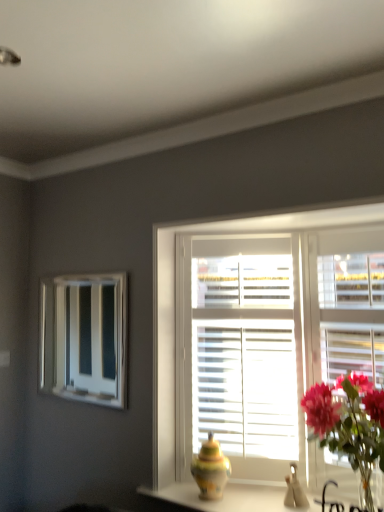
This screenshot has height=512, width=384. Describe the element at coordinates (224, 497) in the screenshot. I see `matte ceramic vase at center` at that location.

Find the location of a particular element. multicolored ceramic vase at center is located at coordinates (211, 469).

At what (x,y) coordinates should I click in order to perform the action: click on white wooden window at center. Please return your answer as a coordinate pair (x, y). Looking at the image, I should click on (264, 334).

The width and height of the screenshot is (384, 512). I want to click on matte ceramic vase at center, so click(x=224, y=497).

Is white wooden window at center to the left or to the right of multicolored ceramic vase at center in the image?

Based on their positions, white wooden window at center is located to the right of multicolored ceramic vase at center.

Is white wooden window at center in front of multicolored ceramic vase at center?

Yes, white wooden window at center is closer to the camera.

Considering the points (251, 222) and (216, 461), which point is behind, point (251, 222) or point (216, 461)?

The point (251, 222) is farther.

Is white wooden window at center inside the boundaries of multicolored ceramic vase at center, or outside?

The correct answer is: outside.

Are white glossy mirror at upper left and matte ceramic vase at center making contact?

No, white glossy mirror at upper left is not touching matte ceramic vase at center.

Which object is further away from the camera taking this photo, white glossy mirror at upper left or matte ceramic vase at center?

white glossy mirror at upper left is behind.

Is point (76, 287) closer to camera compared to point (219, 508)?

No, (76, 287) is further to viewer.

From a real-world perspective, is matte ceramic vase at center positioned under white glossy mirror at upper left based on gravity?

Yes, from a real-world perspective, matte ceramic vase at center is beneath white glossy mirror at upper left.

In the scene shown: Considering the sizes of objects matte ceramic vase at center and white glossy mirror at upper left in the image provided, who is taller, matte ceramic vase at center or white glossy mirror at upper left?

white glossy mirror at upper left.

Is matte ceramic vase at center completely or partially outside of white glossy mirror at upper left?

Yes, matte ceramic vase at center is located beyond the bounds of white glossy mirror at upper left.

Considering the relative sizes of matte ceramic vase at center and white glossy mirror at upper left in the image provided, is matte ceramic vase at center wider than white glossy mirror at upper left?

Yes.

How different are the orientations of white wooden window at center and matte ceramic vase at center in degrees?

The angle between the facing direction of white wooden window at center and the facing direction of matte ceramic vase at center is 0.866 degrees.

Is white wooden window at center aimed at matte ceramic vase at center?

No, white wooden window at center is not oriented towards matte ceramic vase at center.

Who is smaller, white wooden window at center or matte ceramic vase at center?

matte ceramic vase at center.

Is matte ceramic vase at center completely or partially inside white wooden window at center?

Yes, matte ceramic vase at center can be found within white wooden window at center.

From the image's perspective, which object appears higher, white wooden window at center or white glossy mirror at upper left?

white glossy mirror at upper left, from the image's perspective.

Does white wooden window at center have a smaller size compared to white glossy mirror at upper left?

No.

Is white wooden window at center shorter than white glossy mirror at upper left?

No, white wooden window at center is not shorter than white glossy mirror at upper left.

Is there a large distance between white wooden window at center and white glossy mirror at upper left?

Yes, white wooden window at center and white glossy mirror at upper left are quite far apart.

Is matte ceramic vase at center placed right next to multicolored ceramic vase at center?

No.

Does point (143, 493) come in front of point (208, 433)?

Yes, point (143, 493) is closer to viewer.

Is matte ceramic vase at center inside or outside of multicolored ceramic vase at center?

matte ceramic vase at center is spatially situated outside multicolored ceramic vase at center.

Is matte ceramic vase at center in front of or behind multicolored ceramic vase at center in the image?

matte ceramic vase at center is positioned closer to the viewer than multicolored ceramic vase at center.

Which of these two, multicolored ceramic vase at center or white glossy mirror at upper left, is bigger?

With larger size is white glossy mirror at upper left.

From the picture: Does multicolored ceramic vase at center have a greater width compared to white glossy mirror at upper left?

Yes.

Which of these two, multicolored ceramic vase at center or white glossy mirror at upper left, stands taller?

With more height is white glossy mirror at upper left.

From a real-world perspective, is multicolored ceramic vase at center positioned above or below white glossy mirror at upper left?

multicolored ceramic vase at center is situated lower than white glossy mirror at upper left in the real world.

Identify the location of window that appears in front of the multicolored ceramic vase at center. (264, 334).

Locate an element on the screen. counter top below the white glossy mirror at upper left (from the image's perspective) is located at coordinates (224, 497).

Considering their positions, is white glossy mirror at upper left positioned closer to matte ceramic vase at center than white wooden window at center?

white wooden window at center is closer to matte ceramic vase at center.

Considering their positions, is matte ceramic vase at center positioned further to white glossy mirror at upper left than white wooden window at center?

matte ceramic vase at center lies further to white glossy mirror at upper left than the other object.

In the scene shown: Estimate the real-world distances between objects in this image. Which object is further from matte ceramic vase at center, white glossy mirror at upper left or multicolored ceramic vase at center?

white glossy mirror at upper left is positioned further to the anchor matte ceramic vase at center.

Based on their spatial positions, is white glossy mirror at upper left or matte ceramic vase at center further from multicolored ceramic vase at center?

white glossy mirror at upper left.

From the image, which object appears to be nearer to white wooden window at center, matte ceramic vase at center or white glossy mirror at upper left?

matte ceramic vase at center is positioned closer to the anchor white wooden window at center.

From the image, which object appears to be farther from multicolored ceramic vase at center, white glossy mirror at upper left or white wooden window at center?

Among the two, white glossy mirror at upper left is located further to multicolored ceramic vase at center.

From the image, which object appears to be nearer to matte ceramic vase at center, white wooden window at center or white glossy mirror at upper left?

white wooden window at center is positioned closer to the anchor matte ceramic vase at center.

Estimate the real-world distances between objects in this image. Which object is closer to matte ceramic vase at center, multicolored ceramic vase at center or white wooden window at center?

Based on the image, multicolored ceramic vase at center appears to be nearer to matte ceramic vase at center.

Locate an element on the screen. The width and height of the screenshot is (384, 512). vase between white wooden window at center and matte ceramic vase at center in the vertical direction is located at coordinates (211, 469).

The width and height of the screenshot is (384, 512). I want to click on vase located between white glossy mirror at upper left and white wooden window at center in the left-right direction, so click(211, 469).

Where is `counter top between white glossy mirror at upper left and white wooden window at center`? counter top between white glossy mirror at upper left and white wooden window at center is located at coordinates (224, 497).

At what (x,y) coordinates should I click in order to perform the action: click on vase situated between white glossy mirror at upper left and matte ceramic vase at center from left to right. Please return your answer as a coordinate pair (x, y). Looking at the image, I should click on (211, 469).